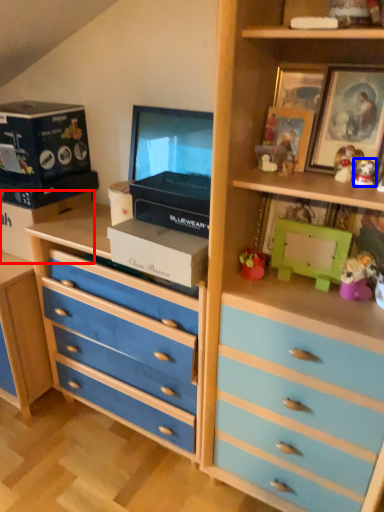
Question: Which of the following is the farthest to the observer, box (highlighted by a red box) or toy (highlighted by a blue box)?

Choices:
 (A) box
 (B) toy

Answer: (A)